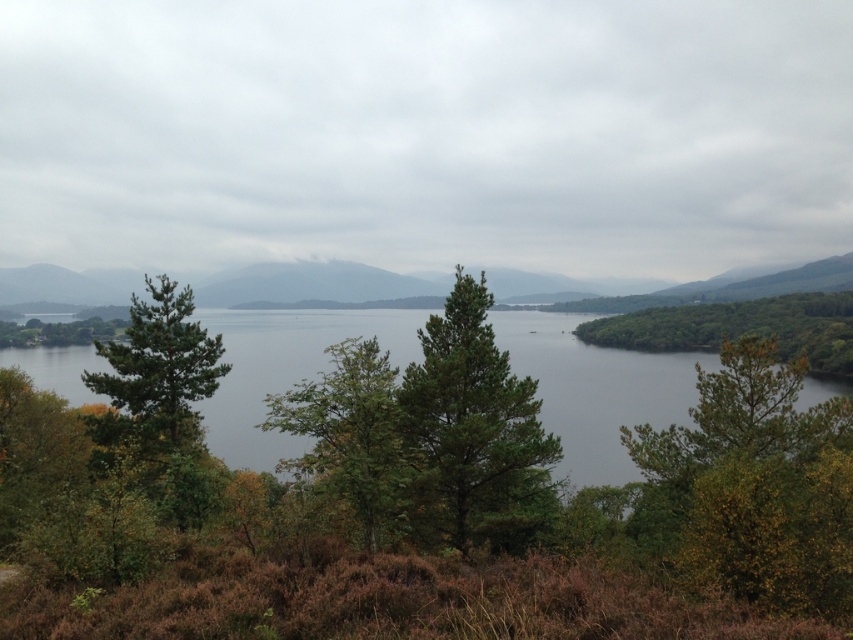
You are a hiker standing at the edge of the lake in the image. You see the matte green mountain at center and the green leafy tree at center. Which object is higher in the scene?

The matte green mountain at center is above the green leafy tree at center, so the matte green mountain at center is higher in the scene.

What does the point at coordinate (311,284) represent in the image?

The point at coordinate (311,284) marks the location of the matte green mountain at center.